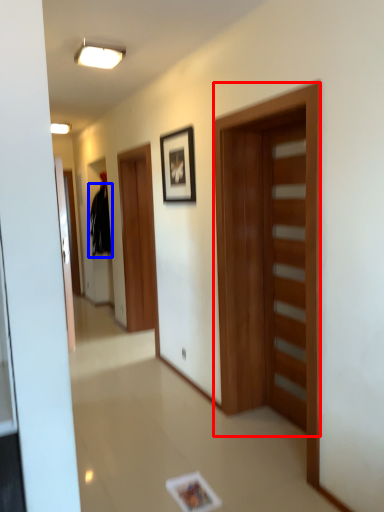
Question: Which of the following is the closest to the observer, door (highlighted by a red box) or sweatshirt (highlighted by a blue box)?

Choices:
 (A) door
 (B) sweatshirt

Answer: (A)